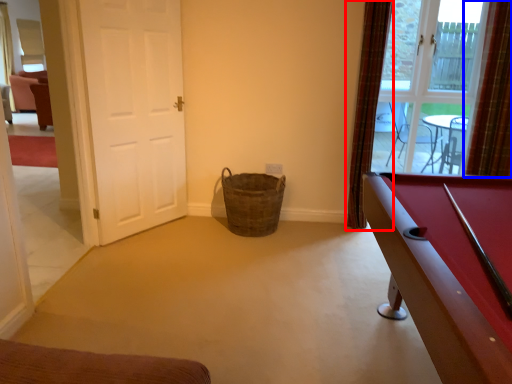
Question: Which object appears farthest to the camera in this image, curtain (highlighted by a red box) or curtain (highlighted by a blue box)?

Choices:
 (A) curtain
 (B) curtain

Answer: (A)